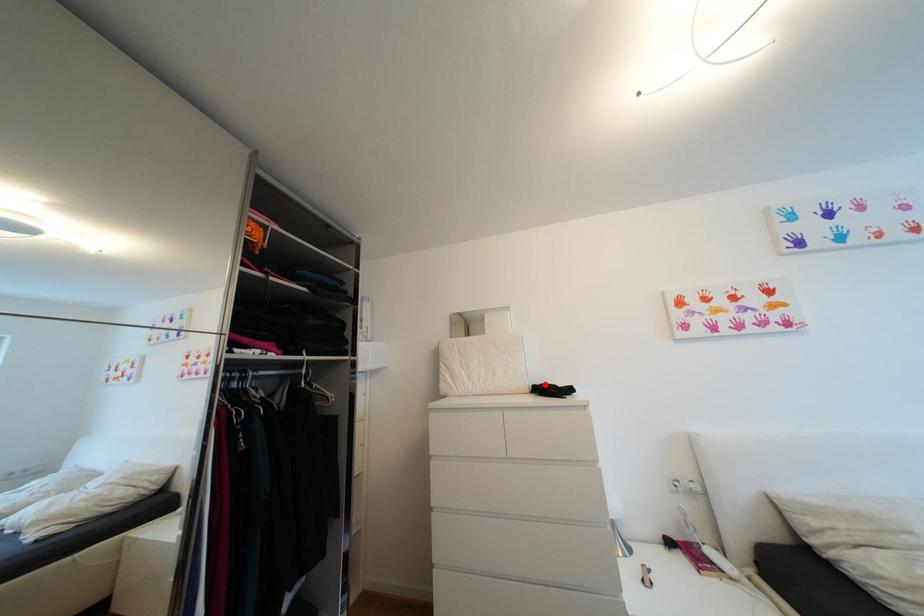
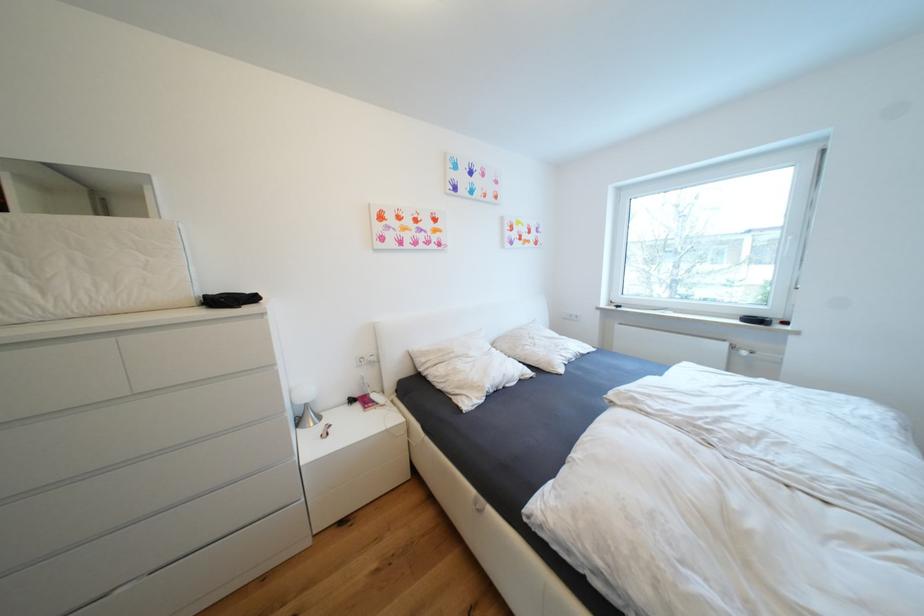
The point at the highlighted location is marked in the first image. Where is the corresponding point in the second image?

(222, 294)